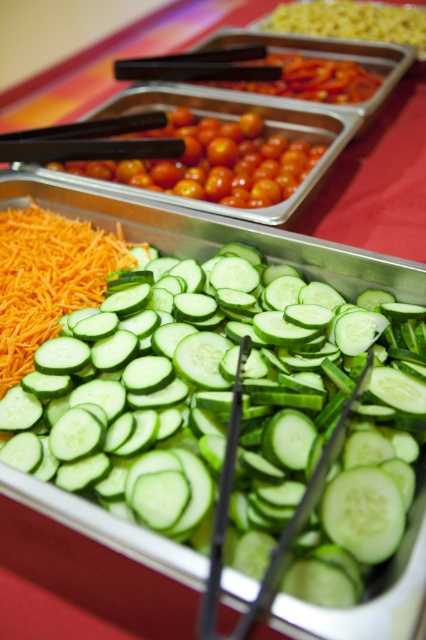
You are a food critic standing at the buffet. You want to take a photo of the green smooth cucumber at center. Where exactly should you focus your camera to capture it perfectly?

The green smooth cucumber at center is located at point 0.648 on the x axis and 0.535 on the y axis, so you should focus your camera at those coordinates to capture it perfectly.

You are a food stylist arranging vegetables on a buffet table. You have a green smooth cucumber at center and glossy cherry tomatoes at center. Which vegetable arrangement has a taller height?

The green smooth cucumber at center has a greater height compared to the glossy cherry tomatoes at center, so the green smooth cucumber at center is taller.